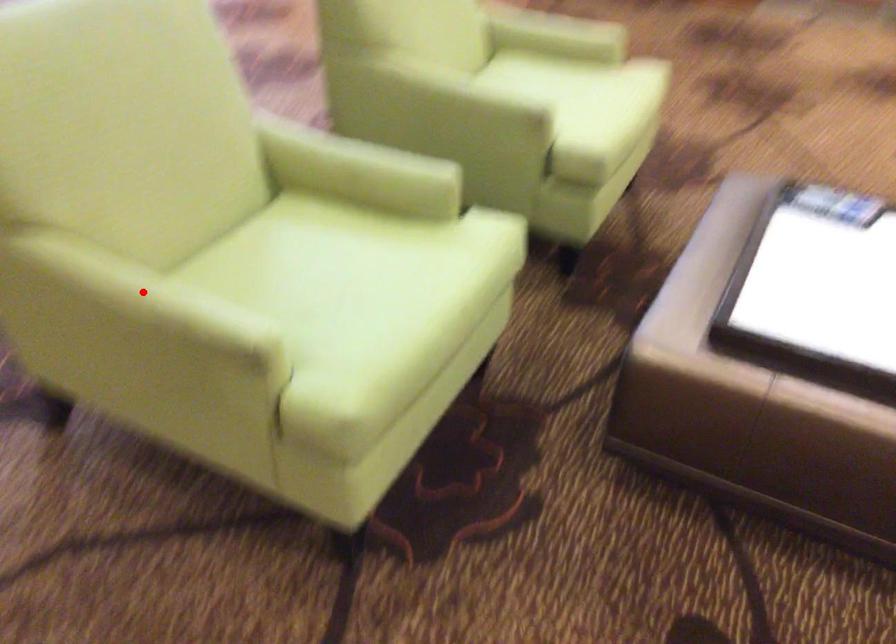
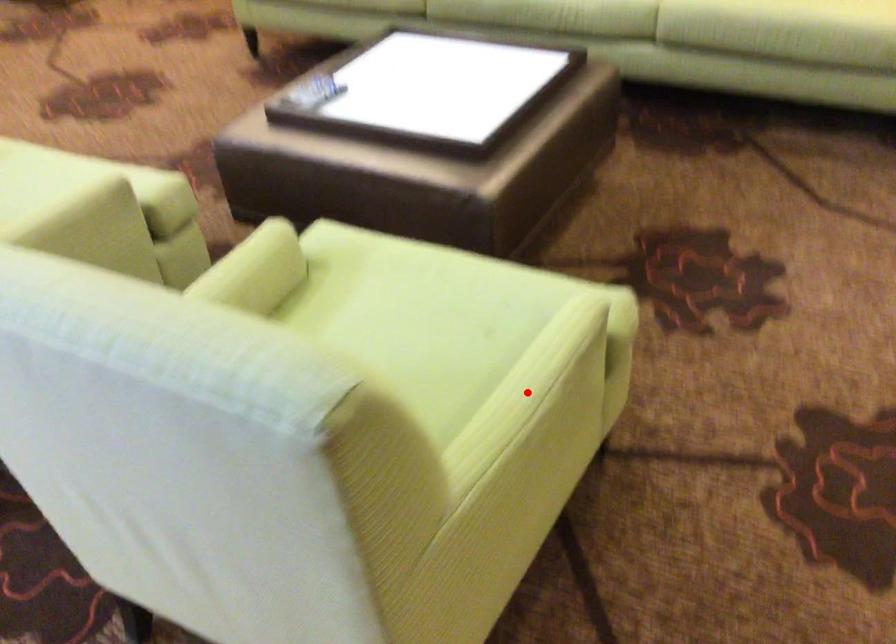
I am providing you with two images of the same scene from different viewpoints. A red point is marked on the first image and another point is marked on the second image. Is the marked point in image1 the same physical position as the marked point in image2?

Yes